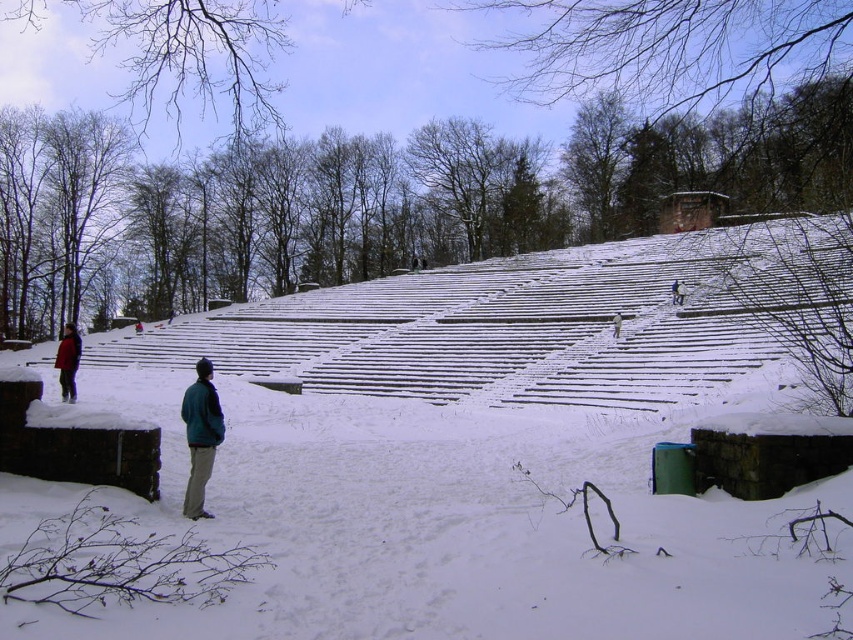
Is white snow at center below green matte jacket at lower left?

No, white snow at center is not below green matte jacket at lower left.

This screenshot has height=640, width=853. Describe the element at coordinates (461, 454) in the screenshot. I see `white snow at center` at that location.

Is point (755, 230) closer to viewer compared to point (206, 428)?

No, (755, 230) is further to viewer.

The width and height of the screenshot is (853, 640). Find the location of `white snow at center`. white snow at center is located at coordinates (461, 454).

Between point (200, 372) and point (64, 349), which one is positioned in front?

Positioned in front is point (200, 372).

Between green matte jacket at lower left and matte black jacket at lower left, which one is positioned lower?

Positioned lower is green matte jacket at lower left.

You are a GUI agent. You are given a task and a screenshot of the screen. Output one action in this format:
    pyautogui.click(x=<x>, y=<y>)
    Task: Click on the green matte jacket at lower left
    Image resolution: width=853 pixels, height=640 pixels.
    Given the screenshot: What is the action you would take?
    pyautogui.click(x=200, y=436)

Which is behind, point (280, 323) or point (71, 380)?

The point (280, 323) is more distant.

Who is shorter, white snow at center or matte black jacket at lower left?

Answer: matte black jacket at lower left is shorter.

Where is `white snow at center`? Image resolution: width=853 pixels, height=640 pixels. white snow at center is located at coordinates (461, 454).

The height and width of the screenshot is (640, 853). I want to click on white snow at center, so pos(461,454).